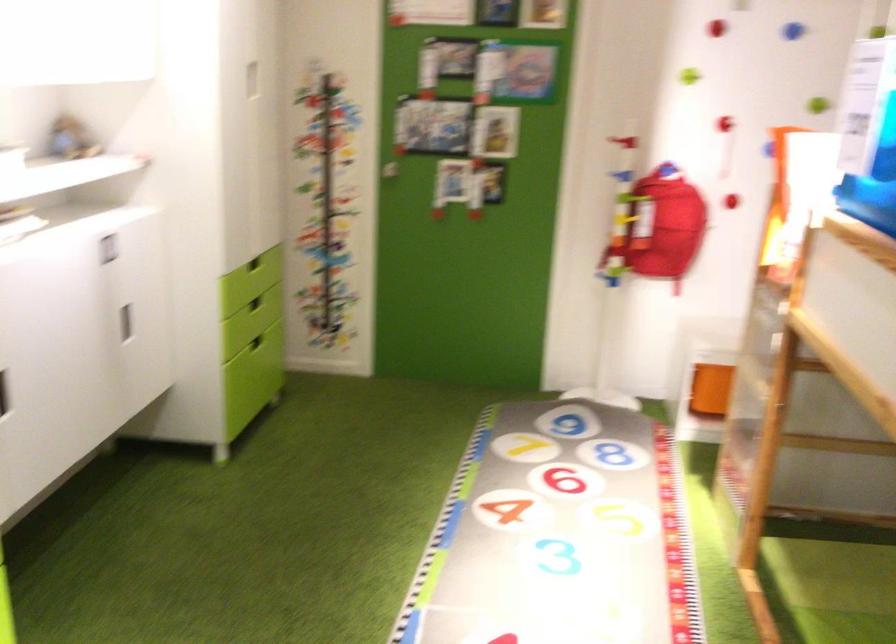
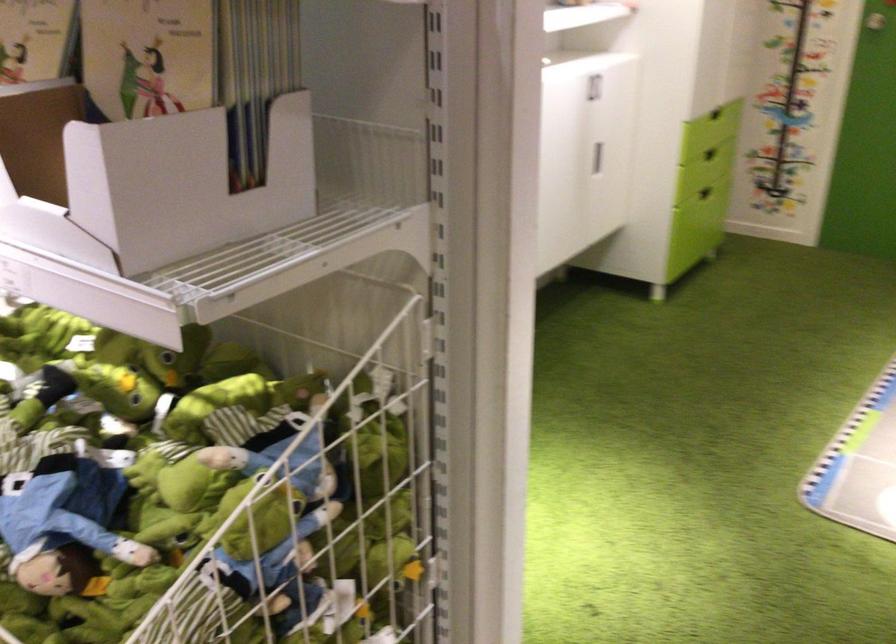
Find the pixel in the second image that matches point (246, 345) in the first image.

(704, 193)